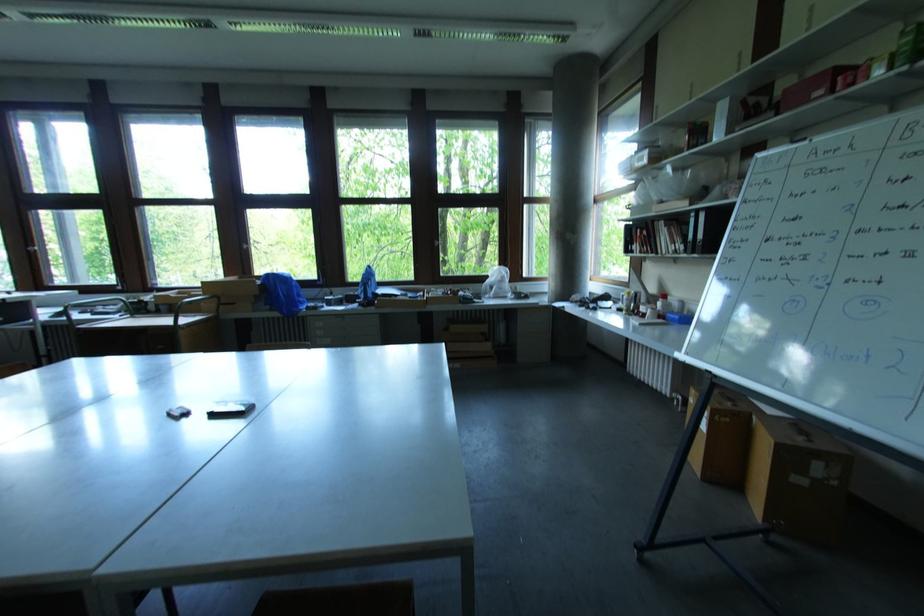
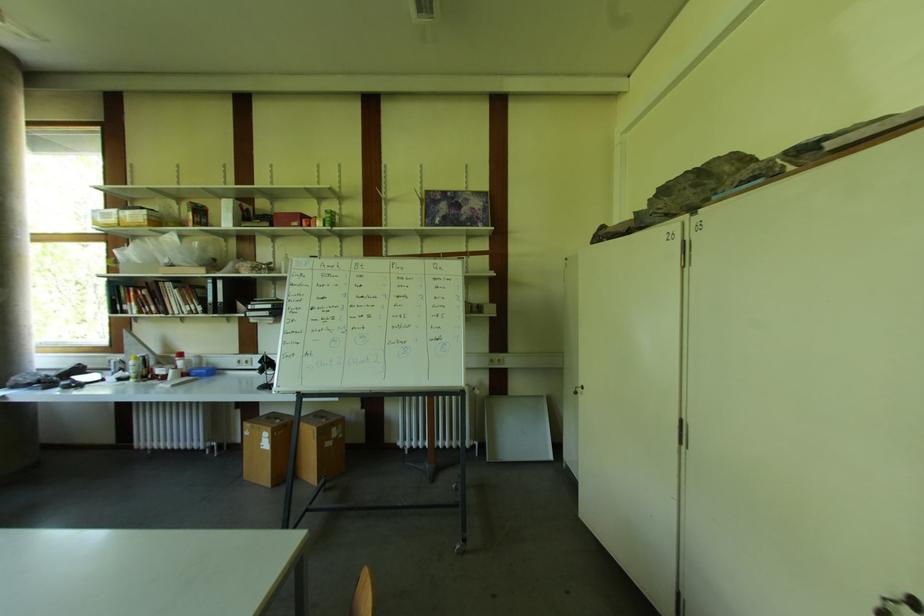
Locate, in the second image, the point that corresponds to point (667, 298) in the first image.

(184, 357)